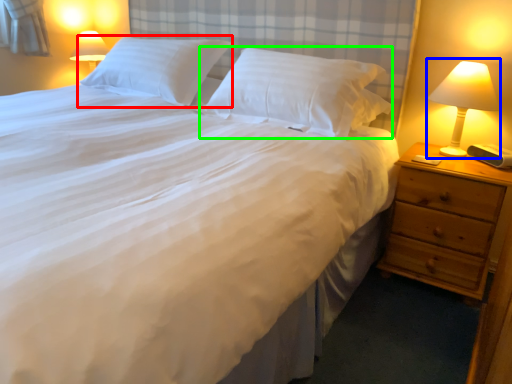
Question: Which is nearer to the pillow (highlighted by a red box)? bedside lamp (highlighted by a blue box) or pillow (highlighted by a green box).

Choices:
 (A) bedside lamp
 (B) pillow

Answer: (B)